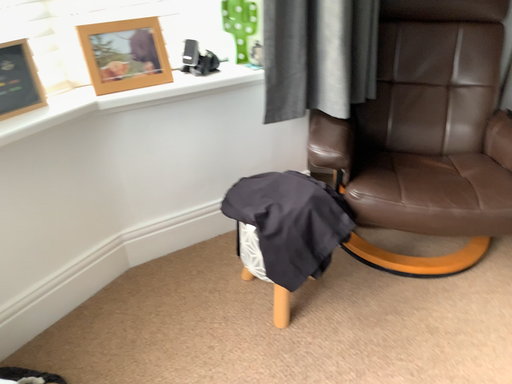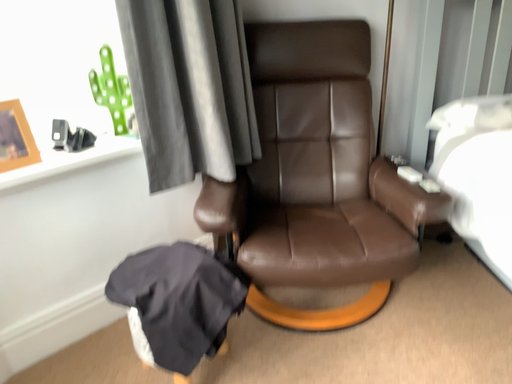
Question: How did the camera likely rotate when shooting the video?

Choices:
 (A) rotated right
 (B) rotated left

Answer: (A)